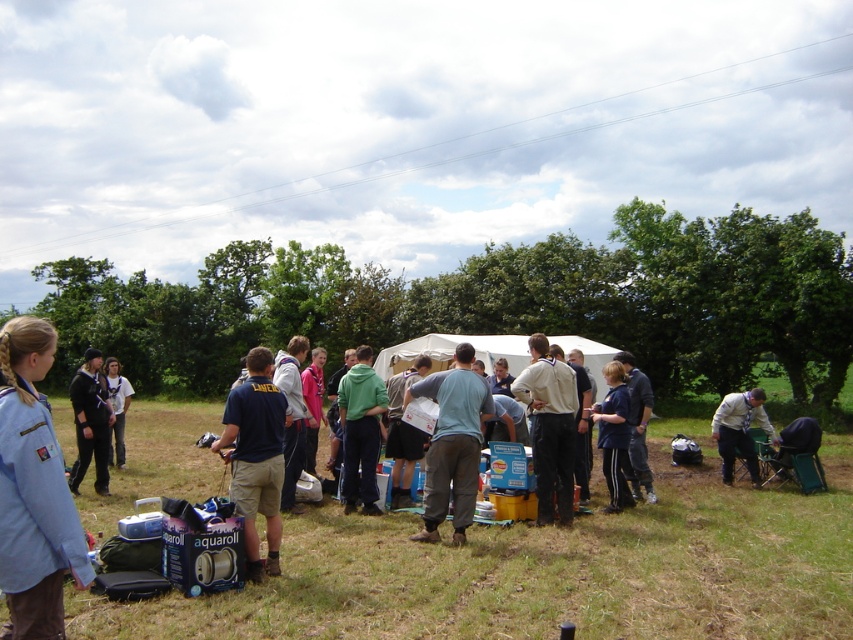
Which is in front, point (607, 465) or point (291, 454)?

Point (291, 454) is more forward.

Who is lower down, black fabric jacket at center or light gray hoodie at center?

black fabric jacket at center is below.

Is point (613, 372) farther from viewer compared to point (277, 353)?

No, (613, 372) is closer to viewer.

This screenshot has width=853, height=640. In order to click on black fabric jacket at center in this screenshot , I will do `click(613, 435)`.

Does point (428, 538) come farther from viewer compared to point (291, 371)?

No, (428, 538) is closer to viewer.

Where is `light blue cotton shirt at center`? light blue cotton shirt at center is located at coordinates (451, 444).

Who is taller, light blue cotton shirt at center or green matte hoodie at center?

With more height is light blue cotton shirt at center.

Is light blue cotton shirt at center taller than green matte hoodie at center?

Yes, light blue cotton shirt at center is taller than green matte hoodie at center.

Is point (465, 488) farther from camera compared to point (369, 454)?

No, it is not.

Find the location of a particular element. light blue cotton shirt at center is located at coordinates (451, 444).